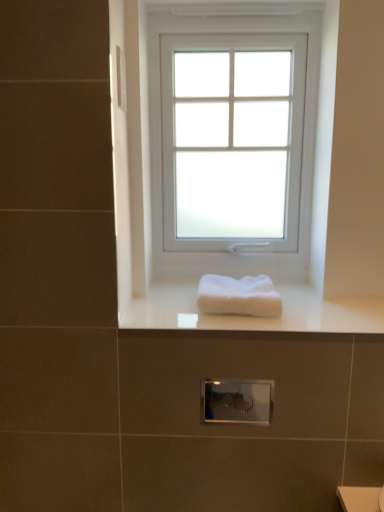
Where is `white frosted glass window at center`? white frosted glass window at center is located at coordinates [232, 144].

What do you see at coordinates (255, 317) in the screenshot? I see `white glossy towel at center` at bounding box center [255, 317].

At what (x,y) coordinates should I click in order to perform the action: click on white frosted glass window at center. Please return your answer as a coordinate pair (x, y). The width and height of the screenshot is (384, 512). Looking at the image, I should click on (232, 144).

Which is in front, white fluffy towel at center or white glossy towel at center?

Positioned in front is white glossy towel at center.

In terms of width, does white fluffy towel at center look wider or thinner when compared to white glossy towel at center?

Clearly, white fluffy towel at center has less width compared to white glossy towel at center.

In the scene shown: From a real-world perspective, which is physically below, white fluffy towel at center or white glossy towel at center?

white glossy towel at center.

From the image's perspective, which one is positioned lower, white fluffy towel at center or white glossy towel at center?

white glossy towel at center is shown below in the image.

Is white glossy towel at center positioned with its back to white frosted glass window at center?

No, white glossy towel at center's orientation is not away from white frosted glass window at center.

Is white glossy towel at center positioned before white frosted glass window at center?

Yes, white glossy towel at center is closer to the viewer.

From a real-world perspective, which object rests below the other?

white glossy towel at center is physically lower.

Which is more to the left, white glossy towel at center or white frosted glass window at center?

From the viewer's perspective, white frosted glass window at center appears more on the left side.

Is white glossy towel at center completely or partially inside white frosted glass window at center?

That's incorrect, white glossy towel at center is not inside white frosted glass window at center.

Between point (294, 26) and point (183, 301), which one is positioned in front?

Point (183, 301)

Does white frosted glass window at center have a smaller size compared to white glossy towel at center?

No.

Considering the positions of objects white frosted glass window at center and white glossy towel at center in the image provided, who is more to the left, white frosted glass window at center or white glossy towel at center?

From the viewer's perspective, white frosted glass window at center appears more on the left side.

From a real-world perspective, between white glossy towel at center and white fluffy towel at center, who is vertically lower?

white glossy towel at center is physically lower.

Locate an element on the screen. The image size is (384, 512). counter top located in front of the white fluffy towel at center is located at coordinates (255, 317).

Could you tell me if white glossy towel at center is facing white fluffy towel at center?

No, white glossy towel at center is not facing towards white fluffy towel at center.

Can you confirm if white glossy towel at center is smaller than white fluffy towel at center?

No, white glossy towel at center is not smaller than white fluffy towel at center.

Is white fluffy towel at center next to white frosted glass window at center and touching it?

No, white fluffy towel at center is not in contact with white frosted glass window at center.

Is point (237, 307) farther from viewer compared to point (304, 193)?

No, (237, 307) is closer to viewer.

Is white fluffy towel at center closer to the viewer compared to white frosted glass window at center?

Yes, it is.

From a real-world perspective, is white fluffy towel at center on white frosted glass window at center?

No, from a real-world perspective, white fluffy towel at center is not above white frosted glass window at center.

Which of these two, white frosted glass window at center or white fluffy towel at center, is bigger?

With larger size is white frosted glass window at center.

Considering the relative sizes of white frosted glass window at center and white fluffy towel at center in the image provided, is white frosted glass window at center taller than white fluffy towel at center?

Yes.

Is white frosted glass window at center in front of or behind white fluffy towel at center in the image?

In the image, white frosted glass window at center appears behind white fluffy towel at center.

Identify the location of counter top located underneath the white fluffy towel at center (from a real-world perspective). (255, 317).

Where is `window that appears above the white glossy towel at center (from the image's perspective)`? The image size is (384, 512). window that appears above the white glossy towel at center (from the image's perspective) is located at coordinates (232, 144).

Looking at the image, which one is located closer to white fluffy towel at center, white frosted glass window at center or white glossy towel at center?

white glossy towel at center is positioned closer to the anchor white fluffy towel at center.

Looking at the image, which one is located closer to white glossy towel at center, white frosted glass window at center or white fluffy towel at center?

white fluffy towel at center is positioned closer to the anchor white glossy towel at center.

Looking at this image, which object lies further to the anchor point white glossy towel at center, white fluffy towel at center or white frosted glass window at center?

→ white frosted glass window at center is further to white glossy towel at center.

Based on their spatial positions, is white glossy towel at center or white fluffy towel at center further from white frosted glass window at center?

white fluffy towel at center is positioned further to the anchor white frosted glass window at center.

When comparing their distances from white fluffy towel at center, does white glossy towel at center or white frosted glass window at center seem closer?

Based on the image, white glossy towel at center appears to be nearer to white fluffy towel at center.

From the image, which object appears to be farther from white frosted glass window at center, white fluffy towel at center or white glossy towel at center?

white fluffy towel at center lies further to white frosted glass window at center than the other object.

Where is `towel between white frosted glass window at center and white glossy towel at center in the vertical direction`? towel between white frosted glass window at center and white glossy towel at center in the vertical direction is located at coordinates (238, 296).